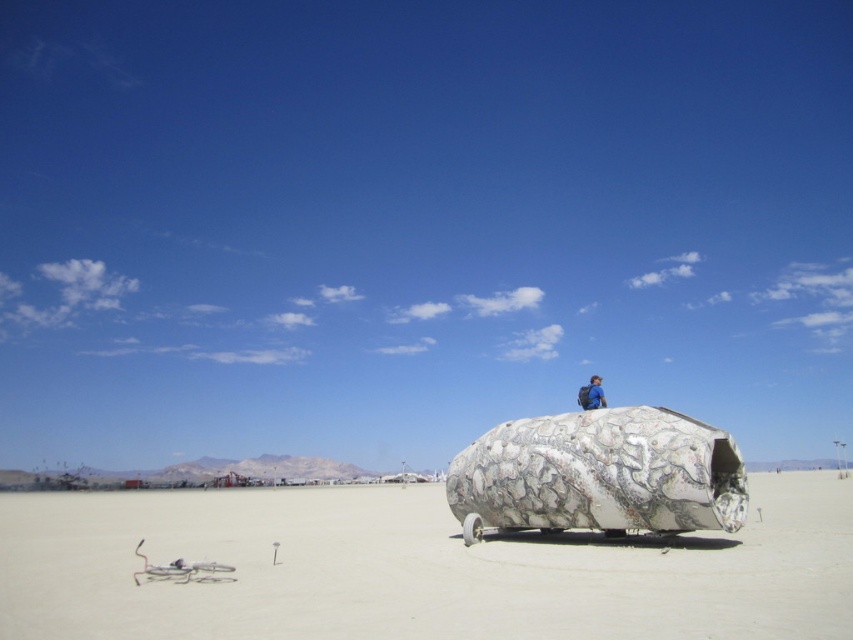
Can you confirm if white sand at center is wider than blue backpack at center?

Yes, white sand at center is wider than blue backpack at center.

This screenshot has height=640, width=853. Identify the location of white sand at center. (416, 570).

Image resolution: width=853 pixels, height=640 pixels. In order to click on white sand at center in this screenshot , I will do `click(416, 570)`.